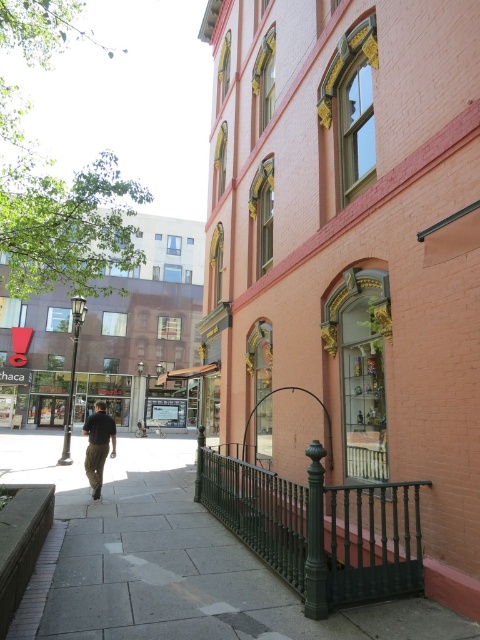
You are standing at the point marked by the coordinates point (169,561). Looking towards the pink brick building, which direction should you walk to stay on the gray concrete sidewalk at lower left?

The gray concrete sidewalk at lower left is located to your left side. To stay on it, you should walk towards the left direction.

You are a delivery person trying to navigate through the street. You see the gray concrete sidewalk at lower left and the dark brown pants at center. Which path is wider for your cart?

The gray concrete sidewalk at lower left might be wider than dark brown pants at center, so it is safer to choose the gray concrete sidewalk at lower left for your cart.